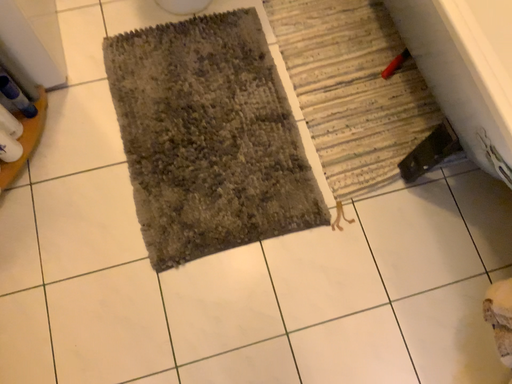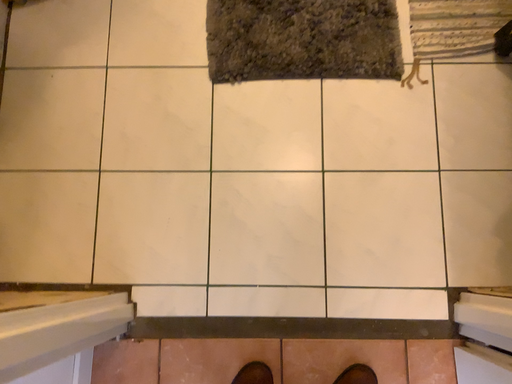
Question: How did the camera likely rotate when shooting the video?

Choices:
 (A) rotated right
 (B) rotated left

Answer: (B)